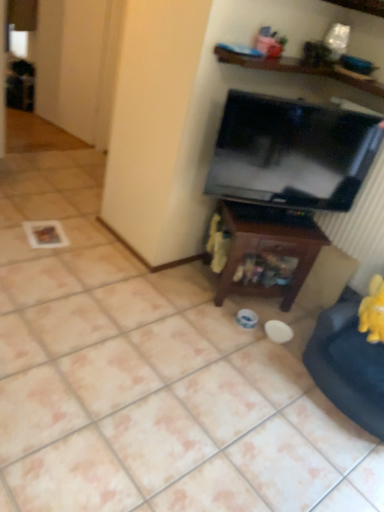
The image size is (384, 512). Find the location of `vacant space that is to the left of velvet yellow swivel chair at lower right`. vacant space that is to the left of velvet yellow swivel chair at lower right is located at coordinates (256, 371).